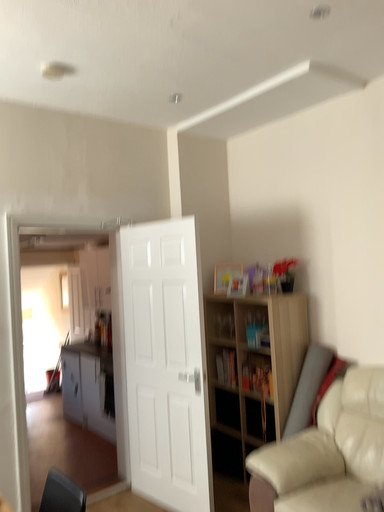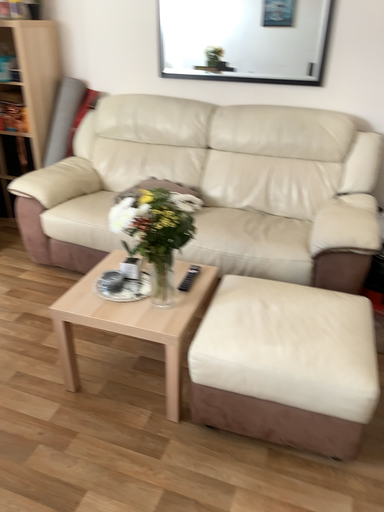
Question: Which way did the camera rotate in the video?

Choices:
 (A) rotated right
 (B) rotated left

Answer: (A)